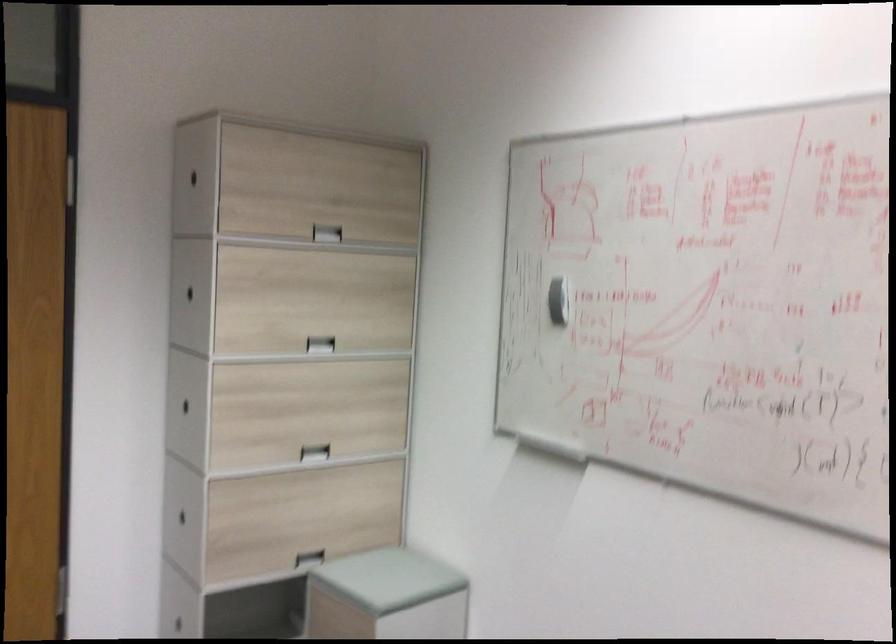
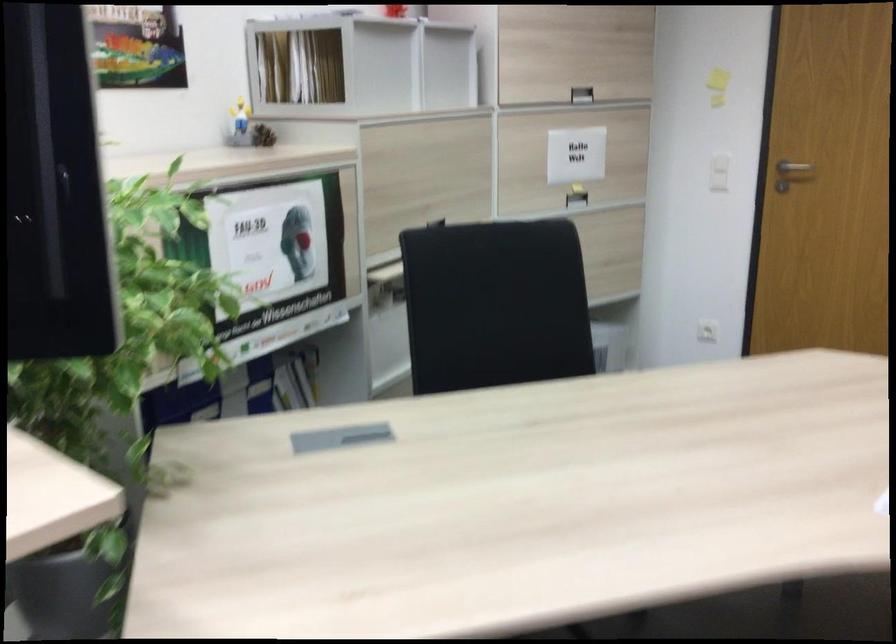
Question: The camera is either moving clockwise (left) or counter-clockwise (right) around the object. The first image is from the beginning of the video and the second image is from the end. Is the camera moving left or right when shooting the video?

Choices:
 (A) Left
 (B) Right

Answer: (B)